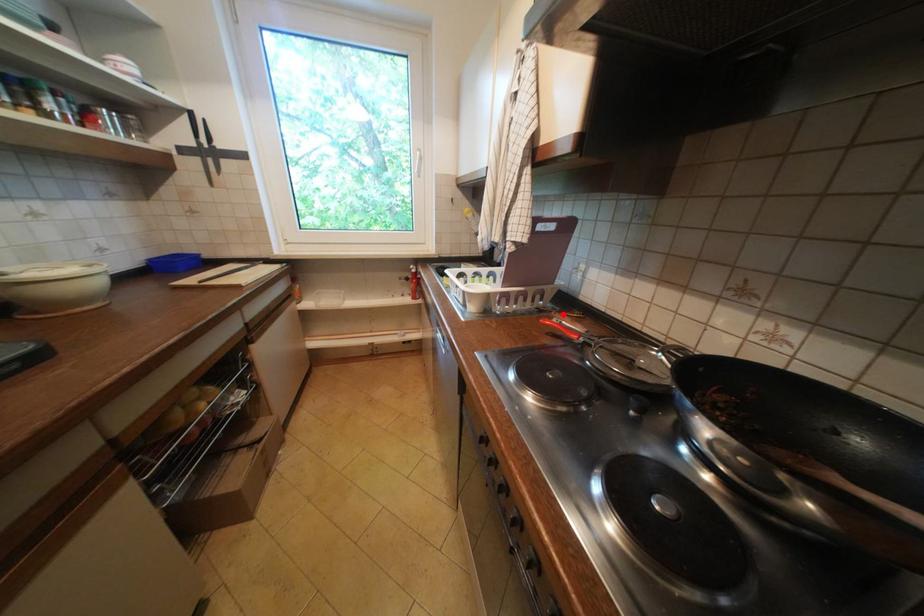
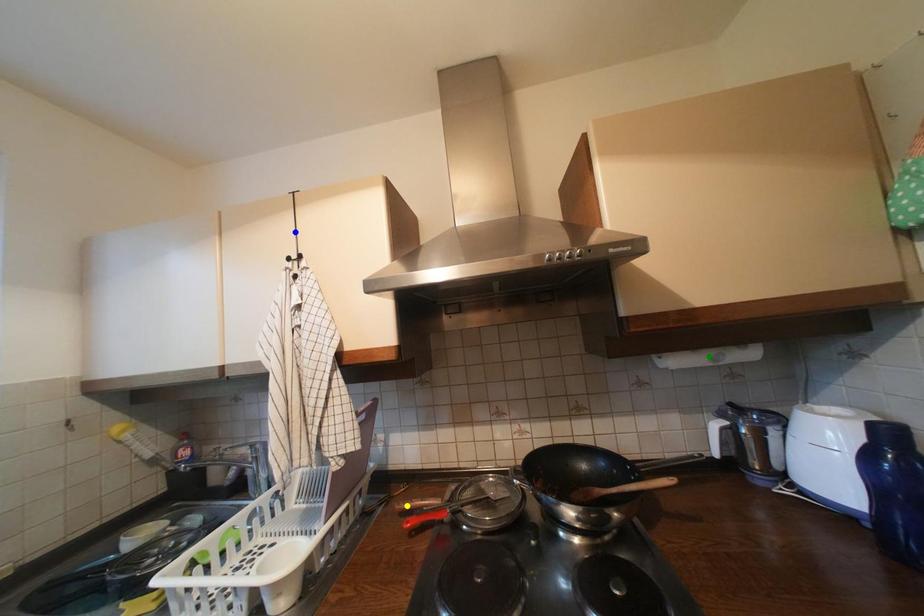
Question: I am providing you with two images of the same scene from different viewpoints. A red point is marked on the first image. You are given multiple points on the second image. Which point in image 2 represents the same 3d spot as the red point in image 1?

Choices:
 (A) yellow point
 (B) blue point
 (C) green point

Answer: (A)